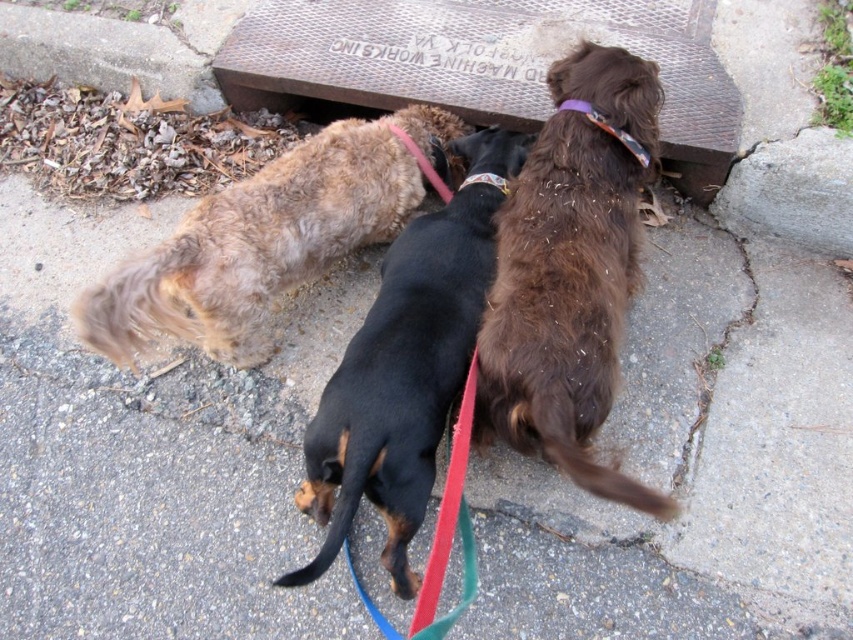
Does gray asphalt pavement at center appear on the right side of brown fuzzy dog at center?

Yes, gray asphalt pavement at center is to the right of brown fuzzy dog at center.

Is point (717, 476) farther from camera compared to point (281, 228)?

No.

Locate an element on the screen. gray asphalt pavement at center is located at coordinates (723, 429).

In the scene shown: Who is more distant from viewer, (296, 259) or (474, 177)?

Positioned behind is point (474, 177).

Does brown fuzzy dog at center appear over multicolored fabric collar at center?

No.

Is point (248, 336) farther from viewer compared to point (482, 173)?

No, (248, 336) is closer to viewer.

Where is `brown fuzzy dog at center`? The image size is (853, 640). brown fuzzy dog at center is located at coordinates (265, 240).

Which is behind, point (730, 486) or point (323, 408)?

Point (730, 486)

Is the position of gray asphalt pavement at center less distant than that of black smooth dachshund at center?

No, gray asphalt pavement at center is behind black smooth dachshund at center.

Is point (746, 573) closer to viewer compared to point (316, 419)?

No.

Find the location of a particular element. The height and width of the screenshot is (640, 853). gray asphalt pavement at center is located at coordinates (723, 429).